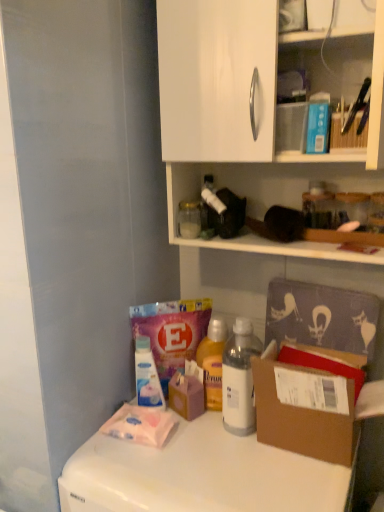
The height and width of the screenshot is (512, 384). Identify the location of free location in front of transparent plastic bottle at lower center, the 3th bottle in the right-to-left sequence. (144, 456).